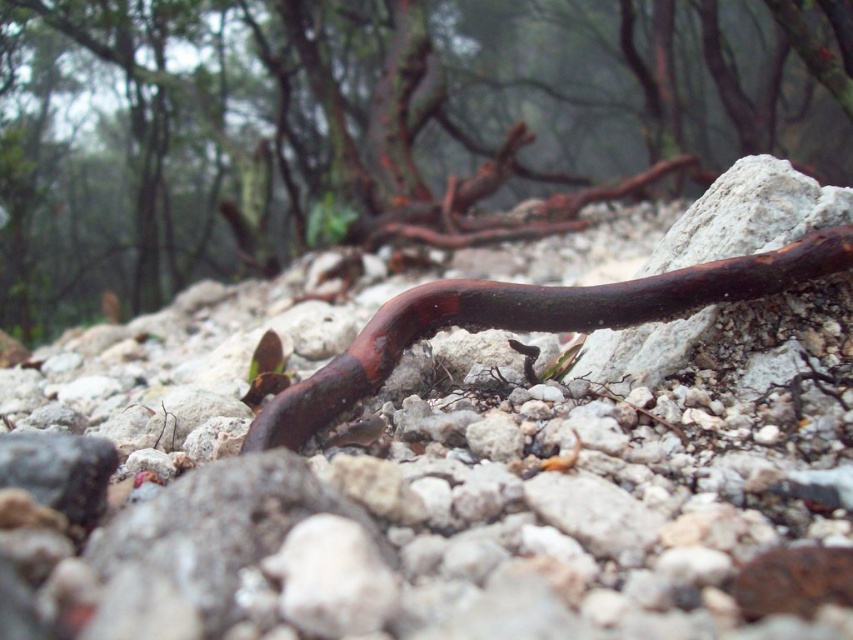
Where is the glossy brown branch at center located in the image?

The glossy brown branch at center is located at point (376,125) in the image.

You are an artist preparing to sketch the scene. You notice the glossy brown branch at center and the rusty metal worm at center. Which object should you draw first if you want to capture the wider object in your sketch?

The glossy brown branch at center should be drawn first because its width surpasses that of the rusty metal worm at center, making it the wider object in the scene.

You are an artist sketching this scene. You need to place the glossy brown branch at center and the rusty metal worm at center accurately. Which object should you draw first if you follow the standard left to right drawing technique?

You should draw the glossy brown branch at center first because it is positioned to the left of the rusty metal worm at center, following the left to right drawing technique.